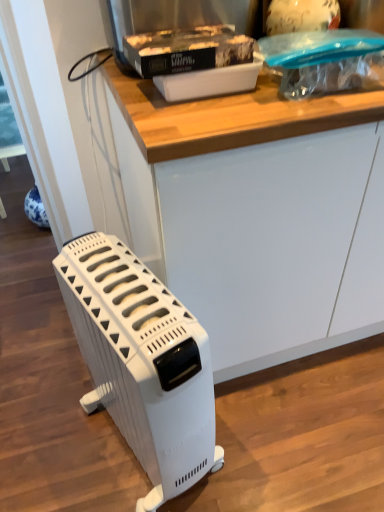
At what (x,y) coordinates should I click in order to perform the action: click on white matte counter at center. Please return your answer as a coordinate pair (x, y). The image size is (384, 512). Looking at the image, I should click on (258, 214).

Find the location of `white matte counter at center`. white matte counter at center is located at coordinates (258, 214).

From the image's perspective, which one is positioned lower, white matte counter at center or white plastic container at upper center?

white matte counter at center is shown below in the image.

Is white matte counter at center shorter than white plastic container at upper center?

Incorrect, the height of white matte counter at center does not fall short of that of white plastic container at upper center.

Which is in front, point (200, 115) or point (117, 42)?

The point (200, 115) is more forward.

Would you say white plastic container at upper center is part of white matte counter at center's contents?

No.

Considering the relative sizes of white plastic heater at lower left and white plastic container at upper center in the image provided, is white plastic heater at lower left thinner than white plastic container at upper center?

No, white plastic heater at lower left is not thinner than white plastic container at upper center.

From a real-world perspective, between white plastic heater at lower left and white plastic container at upper center, who is vertically higher?

From a 3D spatial view, white plastic container at upper center is above.

Is white plastic heater at lower left facing towards white plastic container at upper center?

No, white plastic heater at lower left is not aimed at white plastic container at upper center.

Is point (377, 237) positioned in front of point (62, 289)?

No, (377, 237) is further to viewer.

Consider the image. What's the angular difference between white matte counter at center and white plastic heater at lower left's facing directions?

The angle between the facing direction of white matte counter at center and the facing direction of white plastic heater at lower left is 15.3 degrees.

Is white plastic heater at lower left at the back of white matte counter at center?

white matte counter at center is not turned away from white plastic heater at lower left.

Is white matte counter at center next to white plastic heater at lower left?

white matte counter at center and white plastic heater at lower left are clearly separated.

From the picture: From the image's perspective, is white plastic container at upper center positioned above or below white plastic heater at lower left?

Based on their image positions, white plastic container at upper center is located above white plastic heater at lower left.

At what (x,y) coordinates should I click in order to perform the action: click on appliance above the white plastic heater at lower left (from the image's perspective). Please return your answer as a coordinate pair (x, y). Image resolution: width=384 pixels, height=512 pixels. Looking at the image, I should click on (186, 44).

From a real-world perspective, is white plastic container at upper center positioned above or below white plastic heater at lower left?

From a real-world perspective, white plastic container at upper center is physically above white plastic heater at lower left.

Based on the photo, considering the positions of objects white plastic container at upper center and white matte counter at center in the image provided, who is more to the right, white plastic container at upper center or white matte counter at center?

white matte counter at center.

Considering their positions, is white plastic container at upper center located in front of or behind white matte counter at center?

Visually, white plastic container at upper center is located behind white matte counter at center.

Does point (179, 52) come behind point (215, 211)?

No, it is not.

Considering the relative sizes of white plastic heater at lower left and white matte counter at center in the image provided, is white plastic heater at lower left thinner than white matte counter at center?

Indeed, white plastic heater at lower left has a lesser width compared to white matte counter at center.

Would you say white matte counter at center is part of white plastic heater at lower left's contents?

No, white matte counter at center is located outside of white plastic heater at lower left.

In terms of size, does white plastic heater at lower left appear bigger or smaller than white matte counter at center?

white plastic heater at lower left is smaller than white matte counter at center.

Which is farther from the camera, [126,251] or [214,185]?

Positioned behind is point [126,251].

Find the location of a particular element. The height and width of the screenshot is (512, 384). counter in front of the white plastic container at upper center is located at coordinates (258, 214).

Find the location of a particular element. home appliance located below the white plastic container at upper center (from the image's perspective) is located at coordinates (142, 362).

Considering their positions, is white plastic heater at lower left positioned closer to white plastic container at upper center than white matte counter at center?

white matte counter at center lies closer to white plastic container at upper center than the other object.

Looking at the image, which one is located closer to white plastic container at upper center, white matte counter at center or white plastic heater at lower left?

white matte counter at center lies closer to white plastic container at upper center than the other object.

Based on their spatial positions, is white plastic container at upper center or white plastic heater at lower left closer to white matte counter at center?

white plastic container at upper center is closer to white matte counter at center.

Looking at the image, which one is located further to white matte counter at center, white plastic heater at lower left or white plastic container at upper center?

white plastic heater at lower left.

When comparing their distances from white plastic heater at lower left, does white matte counter at center or white plastic container at upper center seem closer?

white matte counter at center is closer to white plastic heater at lower left.

From the image, which object appears to be farther from white plastic heater at lower left, white plastic container at upper center or white matte counter at center?

white plastic container at upper center.

Identify the location of counter that lies between white plastic container at upper center and white plastic heater at lower left from top to bottom. (258, 214).